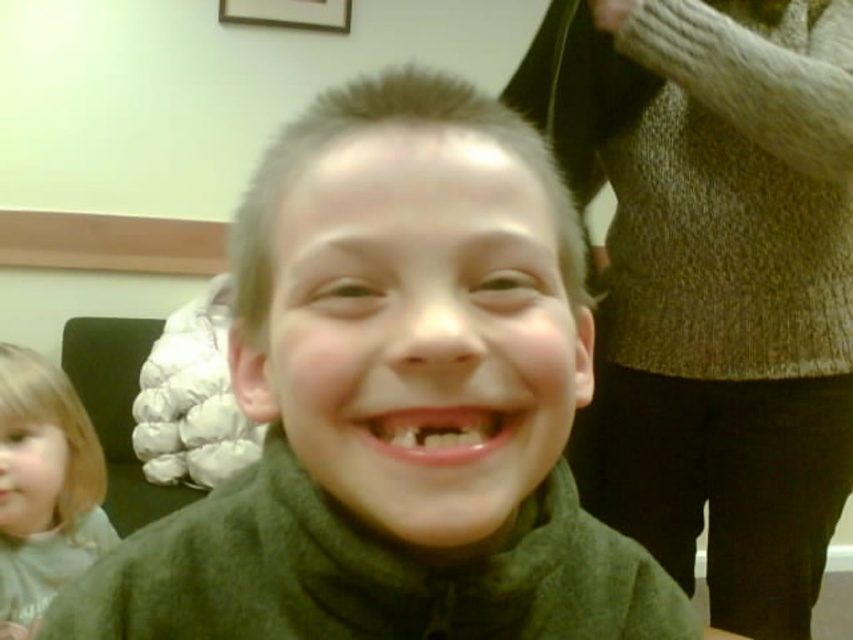
Between point (627, 634) and point (0, 566), which one is positioned in front?

Point (627, 634) is more forward.

Does point (358, 566) come farther from viewer compared to point (22, 573)?

That is False.

Identify the location of green matte jacket at center. (395, 403).

Between point (491, 563) and point (730, 296), which one is positioned in front?

Point (491, 563)

Is point (657, 621) closer to camera compared to point (549, 33)?

Yes, point (657, 621) is closer to viewer.

Locate an element on the screen. green matte jacket at center is located at coordinates (395, 403).

Is green matte jacket at center shorter than short blonde hair at center?

Incorrect, green matte jacket at center's height does not fall short of short blonde hair at center's.

Does green matte jacket at center appear under short blonde hair at center?

Correct, green matte jacket at center is located below short blonde hair at center.

The image size is (853, 640). Describe the element at coordinates (395, 403) in the screenshot. I see `green matte jacket at center` at that location.

At what (x,y) coordinates should I click in order to perform the action: click on green matte jacket at center. Please return your answer as a coordinate pair (x, y). The height and width of the screenshot is (640, 853). Looking at the image, I should click on (395, 403).